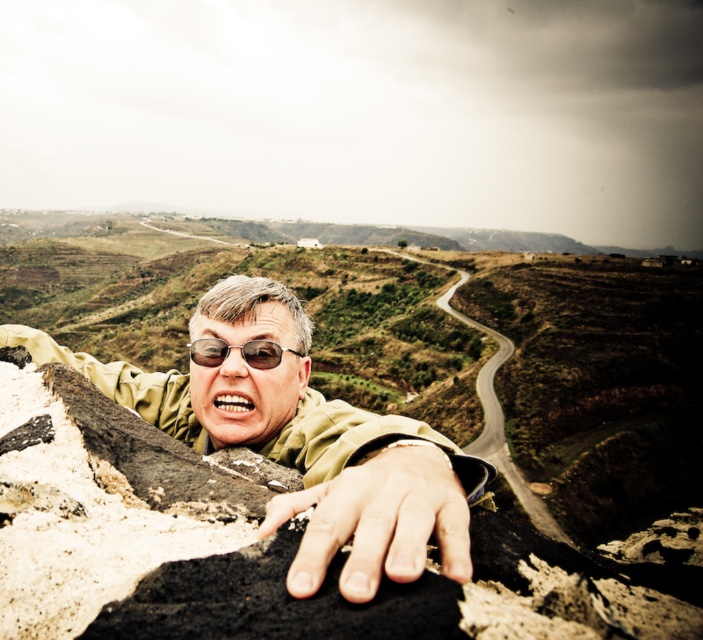
Question: Is the position of matte green jacket at center less distant than that of smooth stone hand at center?

Choices:
 (A) yes
 (B) no

Answer: (B)

Question: Which of these objects is positioned farthest from the matte green jacket at center?

Choices:
 (A) smooth stone hand at center
 (B) sunglasses at center

Answer: (B)

Question: Which of the following is the closest to the observer?

Choices:
 (A) matte green jacket at center
 (B) sunglasses at center

Answer: (A)

Question: Is matte green jacket at center closer to the viewer compared to sunglasses at center?

Choices:
 (A) no
 (B) yes

Answer: (B)

Question: Which of these objects is positioned closest to the smooth stone hand at center?

Choices:
 (A) matte green jacket at center
 (B) sunglasses at center

Answer: (A)

Question: Can you confirm if smooth stone hand at center is thinner than sunglasses at center?

Choices:
 (A) yes
 (B) no

Answer: (B)